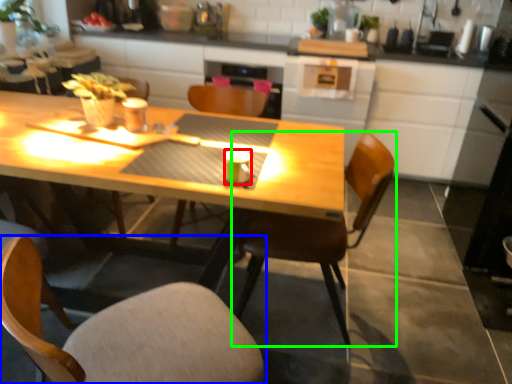
Question: Which object is positioned farthest from coffee cup (highlighted by a red box)? Select from chair (highlighted by a blue box) and chair (highlighted by a green box).

Choices:
 (A) chair
 (B) chair

Answer: (A)